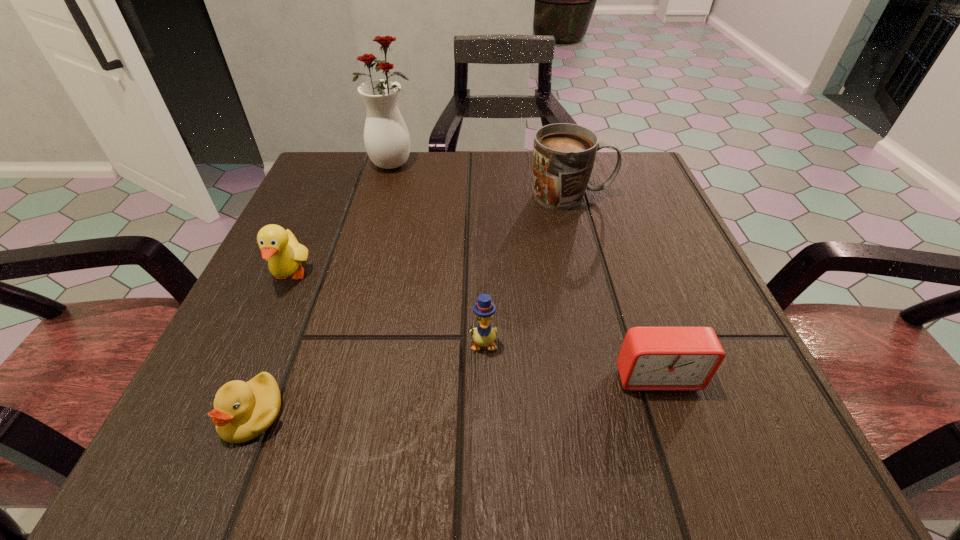
Identify the location of vacant region between the third object from right to left and the alarm clock. This screenshot has height=540, width=960. (570, 360).

The width and height of the screenshot is (960, 540). I want to click on empty space that is in between the alarm clock and the tallest object, so click(x=525, y=269).

Find the location of a particular element. This screenshot has height=540, width=960. vacant area that lies between the mug and the shortest object is located at coordinates (412, 305).

Where is `vacant space that's between the tallest object and the second tallest object`? The height and width of the screenshot is (540, 960). vacant space that's between the tallest object and the second tallest object is located at coordinates (482, 179).

In order to click on unoccupied position between the mug and the farthest duckling in this screenshot , I will do `click(431, 236)`.

Locate an element on the screen. vacant area between the farthest duckling and the mug is located at coordinates (431, 236).

This screenshot has width=960, height=540. Find the location of `free point between the shortest object and the alarm clock`. free point between the shortest object and the alarm clock is located at coordinates (455, 395).

Where is `vacant space that's between the farthest duckling and the mug`? This screenshot has width=960, height=540. vacant space that's between the farthest duckling and the mug is located at coordinates (431, 236).

You are a GUI agent. You are given a task and a screenshot of the screen. Output one action in this format:
    pyautogui.click(x=<x>, y=<y>)
    Task: Click on the unoccupied area between the alarm clock and the fifth shortest object
    The image size is (960, 540).
    Given the screenshot: What is the action you would take?
    pyautogui.click(x=614, y=286)

This screenshot has width=960, height=540. In order to click on free space between the mug and the farthest object in this screenshot , I will do pyautogui.click(x=482, y=179).